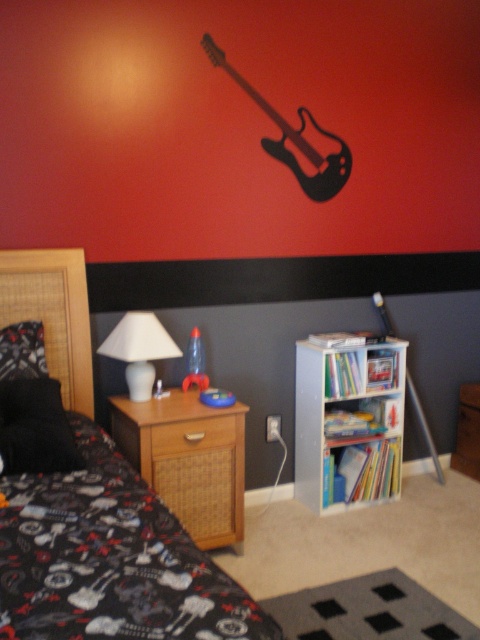
Which is behind, point (46, 349) or point (271, 109)?

The point (271, 109) is more distant.

Can you confirm if black fabric bed at center is thinner than black matte guitar at upper center?

In fact, black fabric bed at center might be wider than black matte guitar at upper center.

Which is in front, point (189, 609) or point (322, 156)?

Point (189, 609) is in front.

Find the location of a particular element. black fabric bed at center is located at coordinates (109, 560).

In the scene shown: Is white plastic bookshelf at lower right shorter than woven wood nightstand at lower left?

Incorrect, white plastic bookshelf at lower right's height does not fall short of woven wood nightstand at lower left's.

Between white plastic bookshelf at lower right and woven wood nightstand at lower left, which one has more height?

With more height is white plastic bookshelf at lower right.

The image size is (480, 640). I want to click on white plastic bookshelf at lower right, so coord(348,422).

Is white plastic bookshelf at lower right closer to the viewer compared to translucent plastic toy at center?

No, white plastic bookshelf at lower right is behind translucent plastic toy at center.

Where is `white plastic bookshelf at lower right`? white plastic bookshelf at lower right is located at coordinates (348, 422).